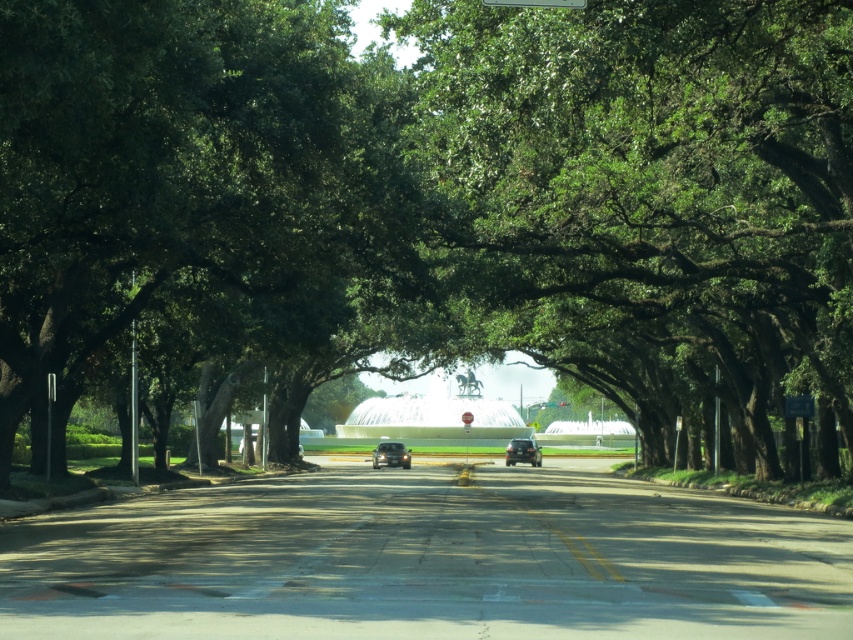
You are driving along a road with a green leafy tree at center and a green plastic street sign at upper center in view. Which object would you hit first if you were to drive straight ahead?

The green leafy tree at center would be hit first because it is closer to the viewer than the green plastic street sign at upper center.

You are driving a car and want to know how far the green leafy tree at center is from your current position. Can you determine the distance?

The green leafy tree at center is 18.58 meters away from the viewer, so the distance between them is 18.58 meters.

You are a driver approaching the green leafy tree at center and the green plastic street sign at upper center. Which object will appear larger in your view as you get closer?

The green leafy tree at center will appear larger in your view as you get closer because it is bigger than the green plastic street sign at upper center according to the description.